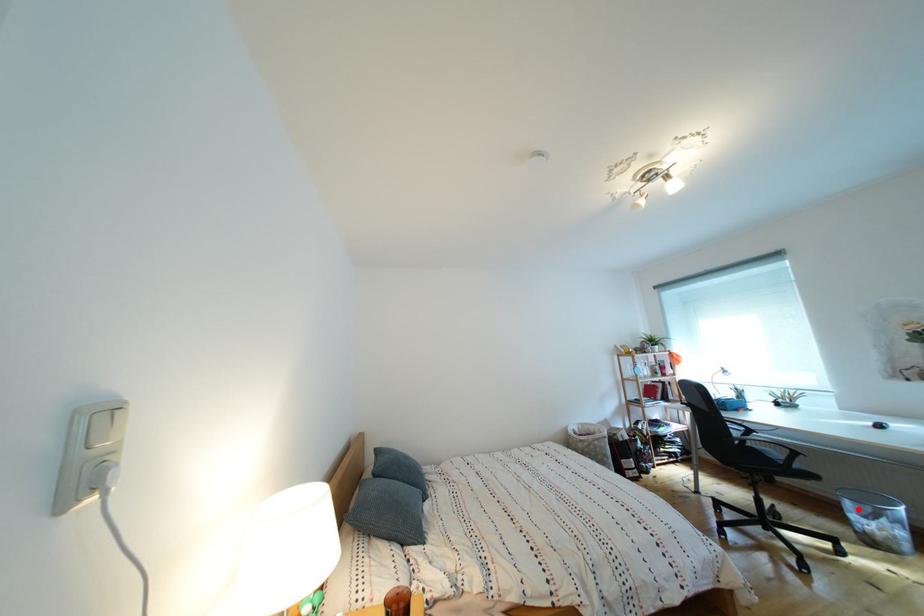
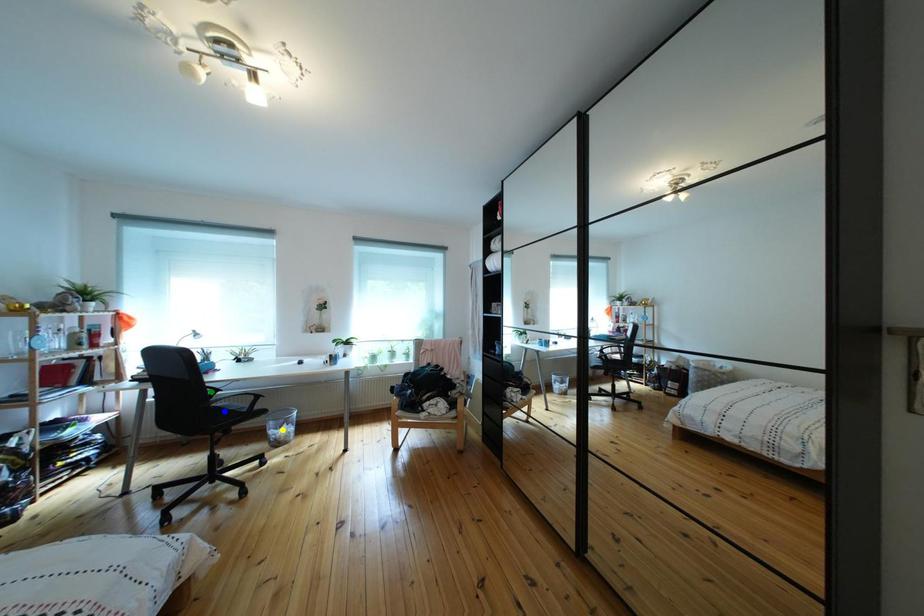
Question: I am providing you with two images of the same scene from different viewpoints. A red point is marked on the first image. You are given multiple points on the second image. Can you choose the point in image 2 that corresponds to the point in image 1?

Choices:
 (A) yellow point
 (B) green point
 (C) blue point

Answer: (A)